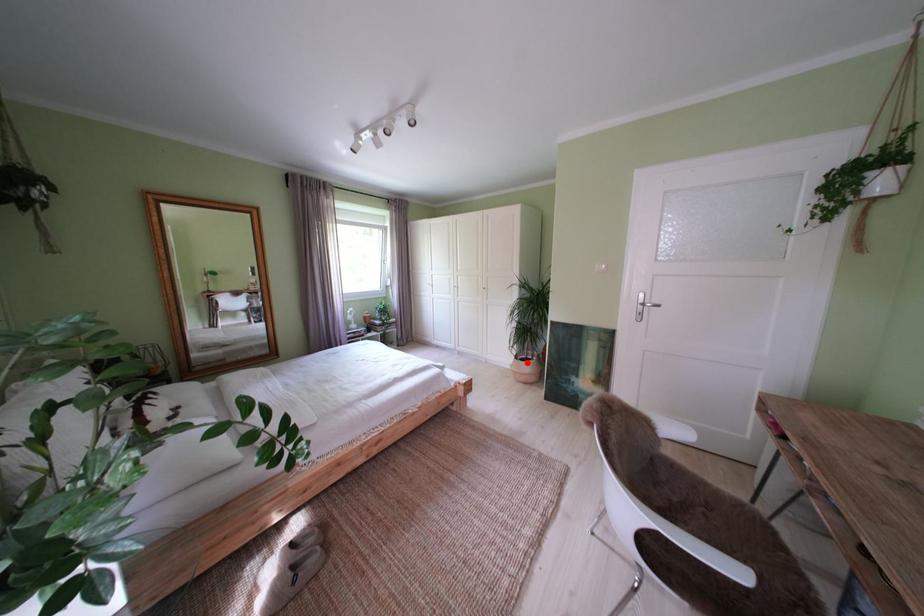
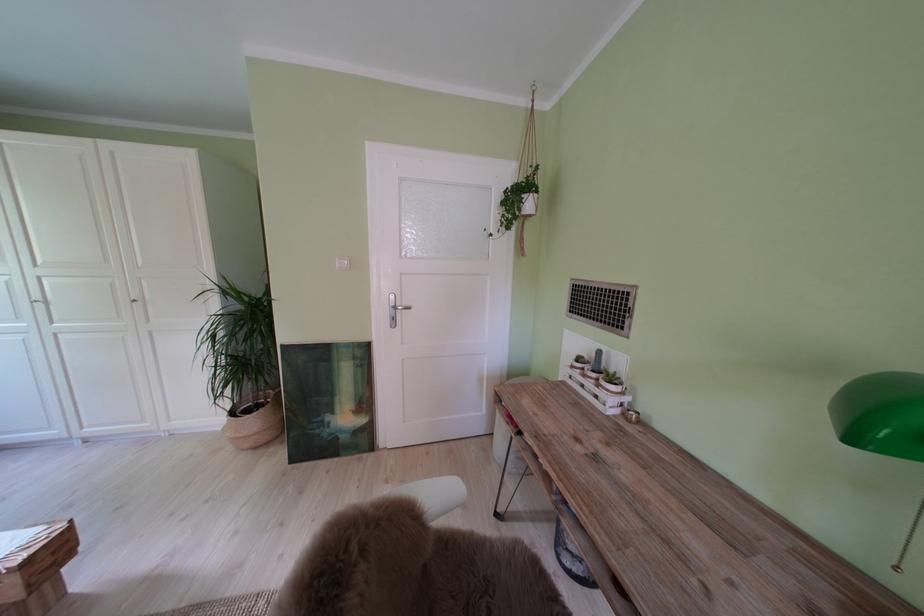
Question: A red point is marked in image1. In image2, is the corresponding 3D point closer to the camera or farther? Reply with the corresponding letter.

Choices:
 (A) The corresponding 3D point is closer.
 (B) The corresponding 3D point is farther.

Answer: (A)